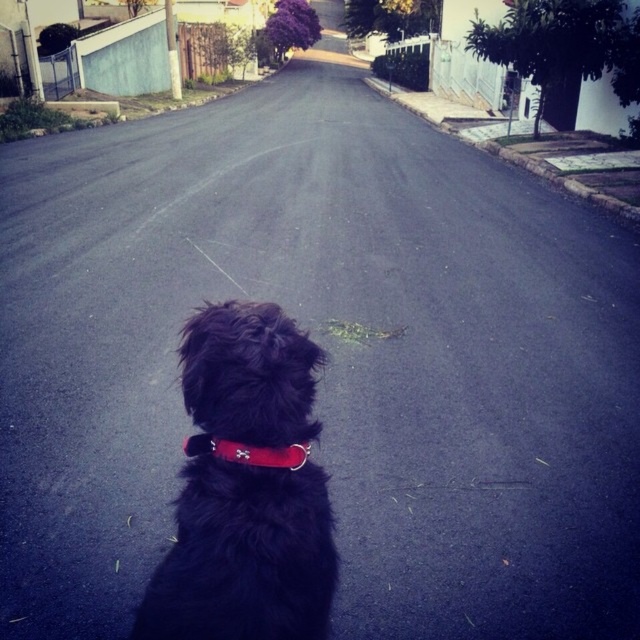
Question: Which of the following is the farthest from the observer?

Choices:
 (A) red matte neckband at center
 (B) black fuzzy dog at center

Answer: (A)

Question: Is black fuzzy dog at center further to camera compared to red matte neckband at center?

Choices:
 (A) no
 (B) yes

Answer: (A)

Question: Is black fuzzy dog at center wider than red matte neckband at center?

Choices:
 (A) yes
 (B) no

Answer: (A)

Question: Which point appears farthest from the camera in this image?

Choices:
 (A) (192, 452)
 (B) (262, 396)

Answer: (A)

Question: Is black fuzzy dog at center to the left of red matte neckband at center from the viewer's perspective?

Choices:
 (A) yes
 (B) no

Answer: (A)